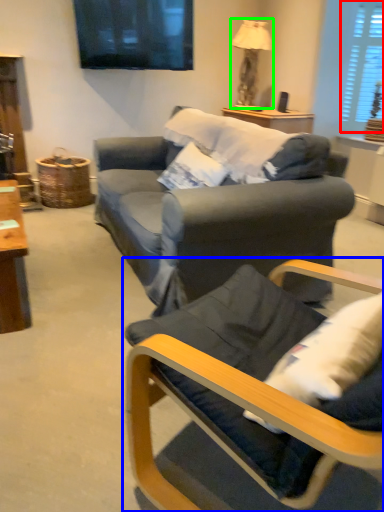
Question: Considering the real-world distances, which object is closest to window (highlighted by a red box)? chair (highlighted by a blue box) or lamp (highlighted by a green box).

Choices:
 (A) chair
 (B) lamp

Answer: (B)